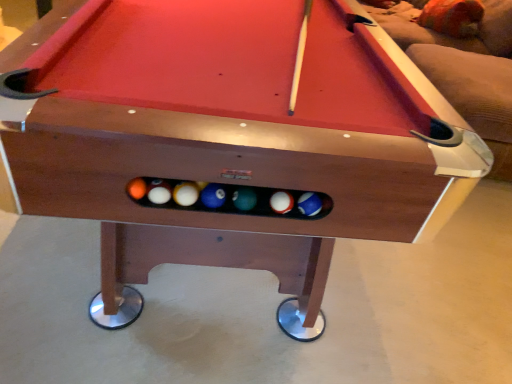
The width and height of the screenshot is (512, 384). Describe the element at coordinates (468, 73) in the screenshot. I see `suede-like beige couch at upper right` at that location.

At what (x,y) coordinates should I click in order to perform the action: click on suede-like beige couch at upper right. Please return your answer as a coordinate pair (x, y). Looking at the image, I should click on click(468, 73).

You are a GUI agent. You are given a task and a screenshot of the screen. Output one action in this format:
    pyautogui.click(x=<x>, y=<y>)
    Task: Click on the suede-like beige couch at upper right
    The height and width of the screenshot is (384, 512).
    Given the screenshot: What is the action you would take?
    pyautogui.click(x=468, y=73)